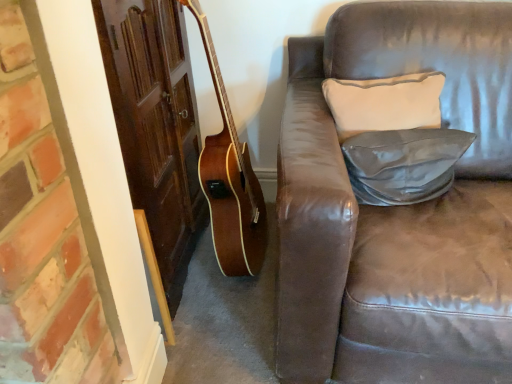
Question: Does leather-like gray pillow at center-right, positioned as the 2th pillow in top-to-bottom order, have a greater height compared to light beige fabric pillow at upper right, arranged as the 2th pillow when ordered from the bottom?

Choices:
 (A) no
 (B) yes

Answer: (A)

Question: Is leather-like gray pillow at center-right, positioned as the 2th pillow in top-to-bottom order, closer to the viewer compared to light beige fabric pillow at upper right, arranged as the 2th pillow when ordered from the bottom?

Choices:
 (A) yes
 (B) no

Answer: (A)

Question: Is leather-like gray pillow at center-right, positioned as the 2th pillow in top-to-bottom order, surrounding light beige fabric pillow at upper right, arranged as the 2th pillow when ordered from the bottom?

Choices:
 (A) yes
 (B) no

Answer: (B)

Question: Is leather-like gray pillow at center-right, placed as the first pillow when sorted from bottom to top, positioned beyond the bounds of light beige fabric pillow at upper right, arranged as the 2th pillow when ordered from the bottom?

Choices:
 (A) yes
 (B) no

Answer: (A)

Question: Is leather-like gray pillow at center-right, positioned as the 2th pillow in top-to-bottom order, smaller than light beige fabric pillow at upper right, arranged as the 2th pillow when ordered from the bottom?

Choices:
 (A) yes
 (B) no

Answer: (A)

Question: Considering the relative sizes of leather-like gray pillow at center-right, placed as the first pillow when sorted from bottom to top, and light beige fabric pillow at upper right, arranged as the 2th pillow when ordered from the bottom, in the image provided, is leather-like gray pillow at center-right, placed as the first pillow when sorted from bottom to top, shorter than light beige fabric pillow at upper right, arranged as the 2th pillow when ordered from the bottom,?

Choices:
 (A) yes
 (B) no

Answer: (A)

Question: From a real-world perspective, is light beige fabric pillow at upper right, the 1th pillow positioned from the top, on top of leather-like gray pillow at center-right, placed as the first pillow when sorted from bottom to top?

Choices:
 (A) no
 (B) yes

Answer: (B)

Question: Is light beige fabric pillow at upper right, arranged as the 2th pillow when ordered from the bottom, positioned in front of leather-like gray pillow at center-right, positioned as the 2th pillow in top-to-bottom order?

Choices:
 (A) yes
 (B) no

Answer: (B)

Question: Is leather-like gray pillow at center-right, placed as the first pillow when sorted from bottom to top, at the back of light beige fabric pillow at upper right, arranged as the 2th pillow when ordered from the bottom?

Choices:
 (A) no
 (B) yes

Answer: (A)

Question: Is light beige fabric pillow at upper right, the 1th pillow positioned from the top, facing towards leather-like gray pillow at center-right, positioned as the 2th pillow in top-to-bottom order?

Choices:
 (A) no
 (B) yes

Answer: (B)

Question: From the image's perspective, would you say light beige fabric pillow at upper right, arranged as the 2th pillow when ordered from the bottom, is positioned over leather-like gray pillow at center-right, placed as the first pillow when sorted from bottom to top?

Choices:
 (A) no
 (B) yes

Answer: (B)

Question: Does light beige fabric pillow at upper right, arranged as the 2th pillow when ordered from the bottom, appear on the right side of leather-like gray pillow at center-right, positioned as the 2th pillow in top-to-bottom order?

Choices:
 (A) no
 (B) yes

Answer: (A)

Question: Is point (412, 112) closer or farther from the camera than point (400, 178)?

Choices:
 (A) farther
 (B) closer

Answer: (A)